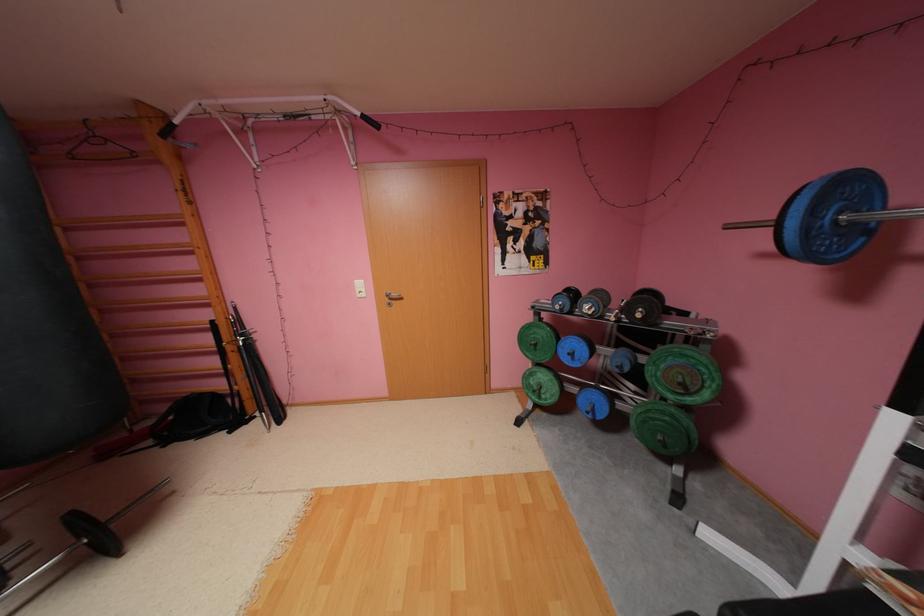
The width and height of the screenshot is (924, 616). What do you see at coordinates (359, 288) in the screenshot? I see `the white light switch` at bounding box center [359, 288].